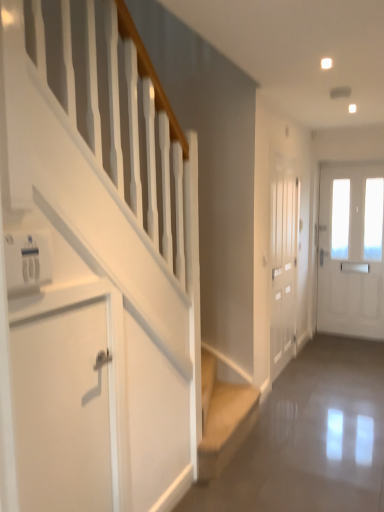
Question: From the image's perspective, is white frosted glass door at center, positioned as the second door in right-to-left order, positioned above or below beige fabric stairs at lower center?

Choices:
 (A) above
 (B) below

Answer: (A)

Question: Relative to beige fabric stairs at lower center, is white frosted glass door at center, positioned as the second door in right-to-left order, in front or behind?

Choices:
 (A) behind
 (B) front

Answer: (A)

Question: Which object is positioned farthest from the white matte door at lower left, which is counted as the 1th door, starting from the front?

Choices:
 (A) white glossy door at right, marked as the third door in a left-to-right arrangement
 (B) white frosted glass door at center, which is the 2th door from left to right
 (C) beige fabric stairs at lower center

Answer: (A)

Question: Estimate the real-world distances between objects in this image. Which object is closer to the white frosted glass door at center, which ranks as the second door in back-to-front order?

Choices:
 (A) white glossy door at right, the third door when ordered from front to back
 (B) beige fabric stairs at lower center
 (C) white matte door at lower left, positioned as the third door in right-to-left order

Answer: (B)